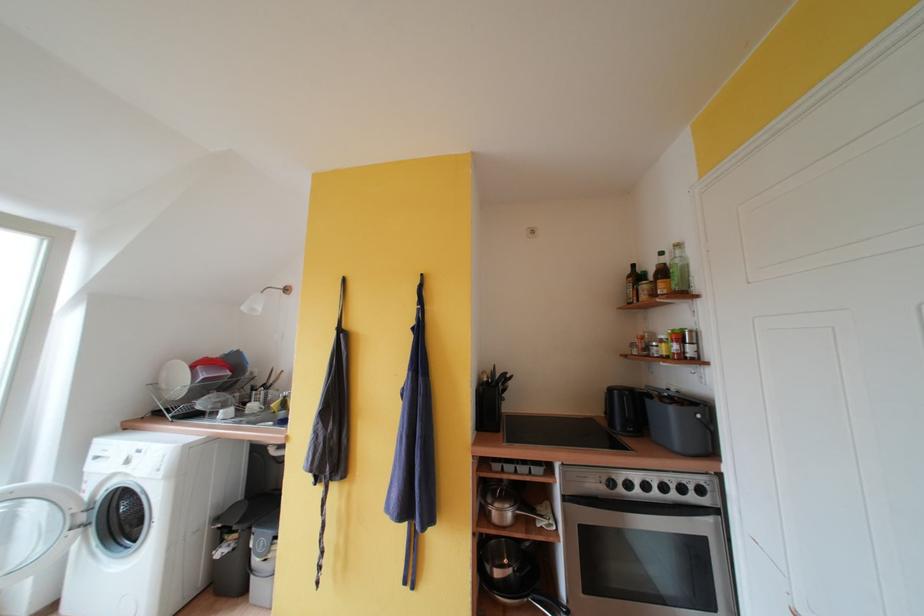
This screenshot has height=616, width=924. I want to click on silver pot handle, so click(540, 515).